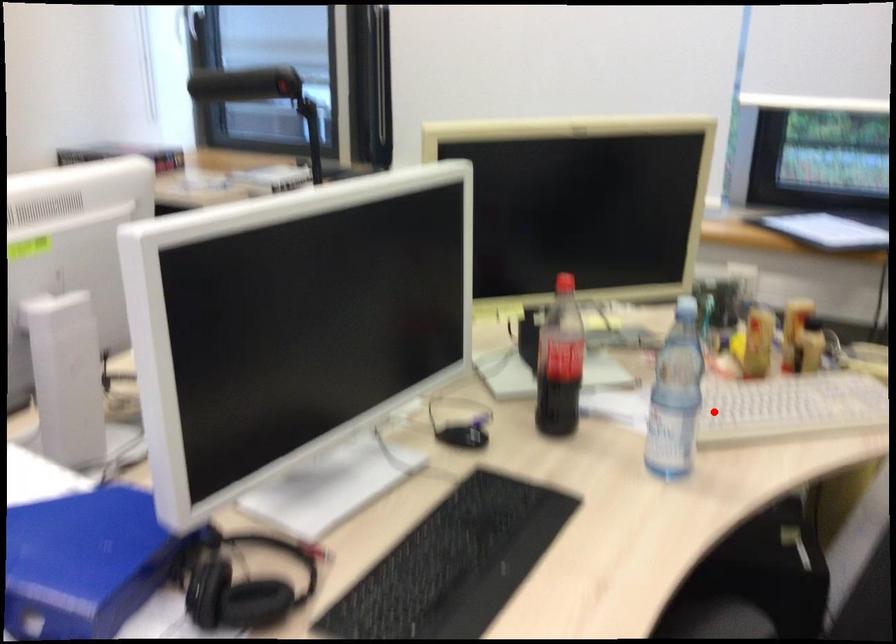
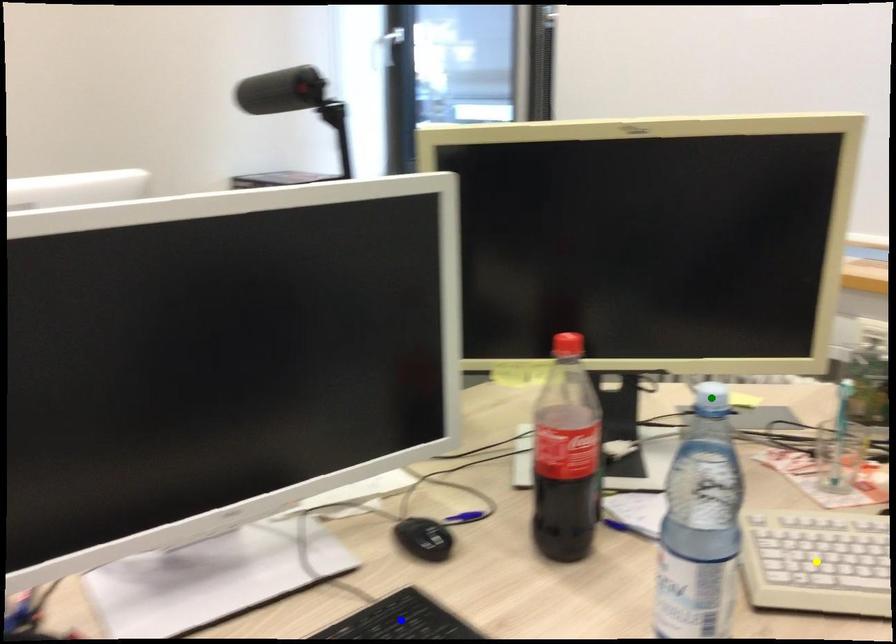
Question: I am providing you with two images of the same scene from different viewpoints. A red point is marked on the first image. You are given multiple points on the second image. Which point in image 2 is actually the same real-world point as the red point in image 1?

Choices:
 (A) blue point
 (B) yellow point
 (C) green point

Answer: (B)